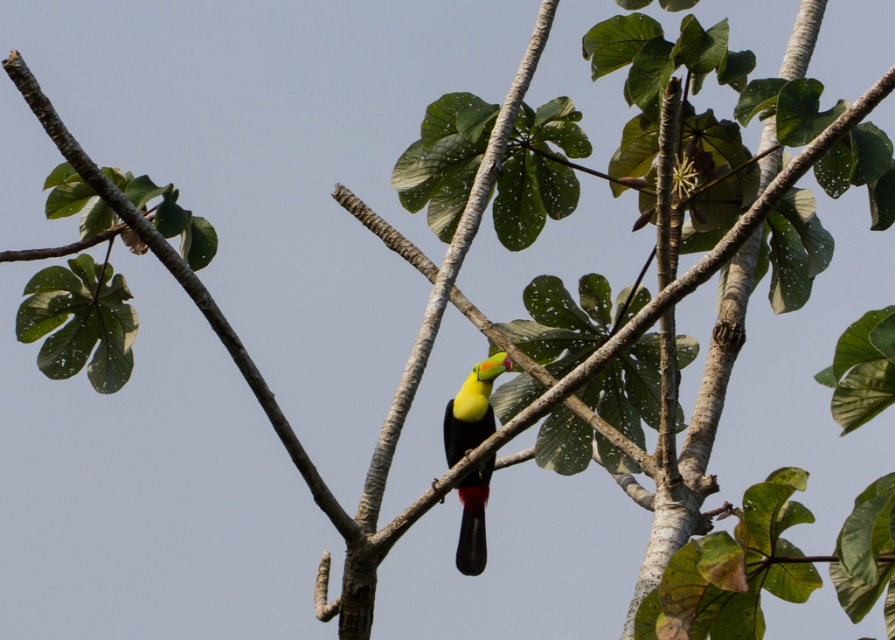
Between green matte leaf at upper left and yellow matte parrot at center, which one is positioned higher?

green matte leaf at upper left is above.

Is green matte leaf at upper left to the left of yellow matte parrot at center from the viewer's perspective?

Indeed, green matte leaf at upper left is positioned on the left side of yellow matte parrot at center.

Where is `green matte leaf at upper left`? This screenshot has height=640, width=895. green matte leaf at upper left is located at coordinates (182, 285).

What are the coordinates of `green matte leaf at upper left` in the screenshot? It's located at (182, 285).